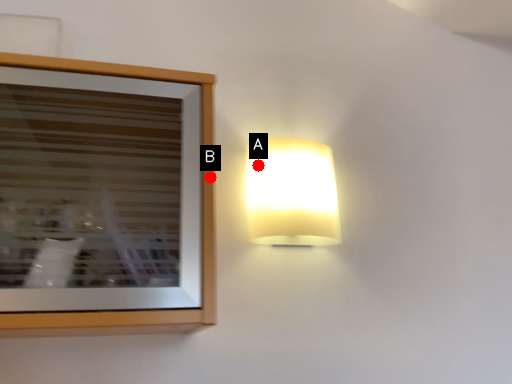
Question: Two points are circled on the image, labeled by A and B beside each circle. Which point is farther to the camera?

Choices:
 (A) A is further
 (B) B is further

Answer: (A)